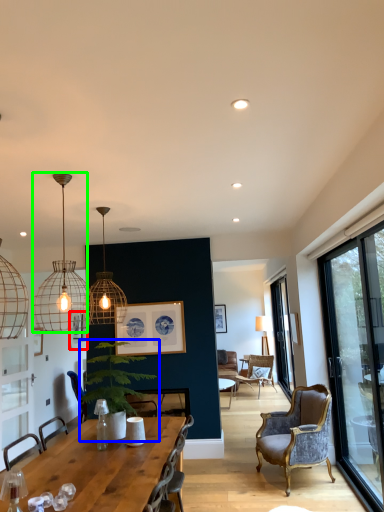
Question: Estimate the real-world distances between objects in this image. Which object is farther from picture frame (highlighted by a red box), houseplant (highlighted by a blue box) or lamp (highlighted by a green box)?

Choices:
 (A) houseplant
 (B) lamp

Answer: (A)